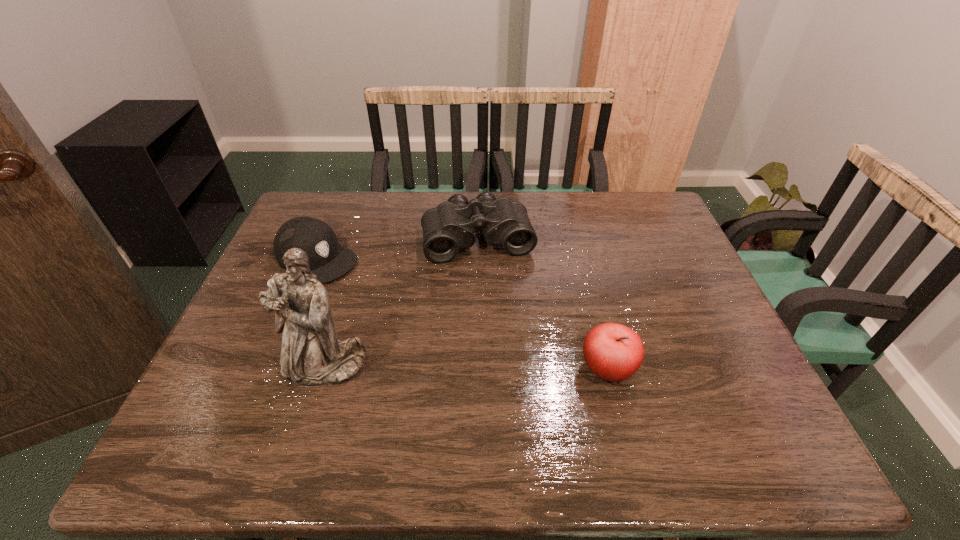
Locate an element on the screen. The image size is (960, 540). the tallest object is located at coordinates (312, 355).

Where is `the rightmost object`? The image size is (960, 540). the rightmost object is located at coordinates (613, 352).

Find the location of `cap`. cap is located at coordinates (328, 260).

I want to click on the second object from right to left, so 448,227.

At what (x,y) coordinates should I click in order to perform the action: click on free region located 0.110m on the left of the apple. Please return your answer as a coordinate pair (x, y). Looking at the image, I should click on (532, 370).

The width and height of the screenshot is (960, 540). Find the location of `free space located 0.130m on the front-facing side of the cap`. free space located 0.130m on the front-facing side of the cap is located at coordinates (375, 295).

Identify the location of vacant space located 0.300m on the front-facing side of the cap. (421, 326).

The width and height of the screenshot is (960, 540). In order to click on free space located 0.350m on the front-facing side of the cap in this screenshot , I will do `click(436, 335)`.

Locate an element on the screen. This screenshot has height=540, width=960. free space located at the eyepieces of the binoculars is located at coordinates (498, 313).

This screenshot has width=960, height=540. Find the location of `vacant space situated at the eyepieces of the binoculars`. vacant space situated at the eyepieces of the binoculars is located at coordinates tap(513, 375).